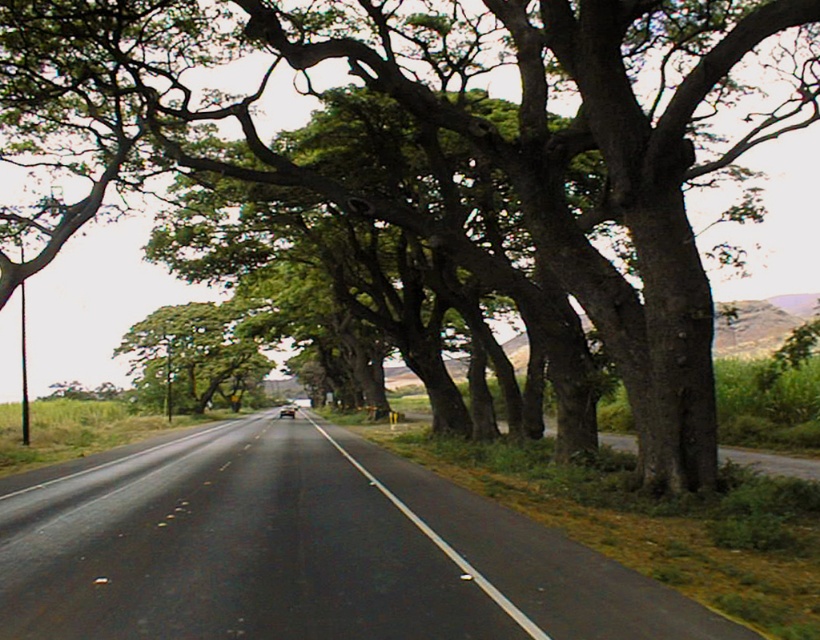
Question: Can you confirm if black asphalt highway at center is smaller than green leafy tree at center?

Choices:
 (A) yes
 (B) no

Answer: (A)

Question: Does green leafy tree at center have a larger size compared to black asphalt road at center?

Choices:
 (A) no
 (B) yes

Answer: (B)

Question: Is black asphalt highway at center behind black asphalt road at center?

Choices:
 (A) yes
 (B) no

Answer: (B)

Question: Among these objects, which one is nearest to the camera?

Choices:
 (A) black asphalt road at center
 (B) green leafy tree at center
 (C) black asphalt highway at center

Answer: (C)

Question: Which is farther from the black asphalt highway at center?

Choices:
 (A) green leafy tree at center
 (B) black asphalt road at center

Answer: (A)

Question: Which of the following is the closest to the observer?

Choices:
 (A) green leafy tree at center
 (B) black asphalt road at center
 (C) black asphalt highway at center

Answer: (C)